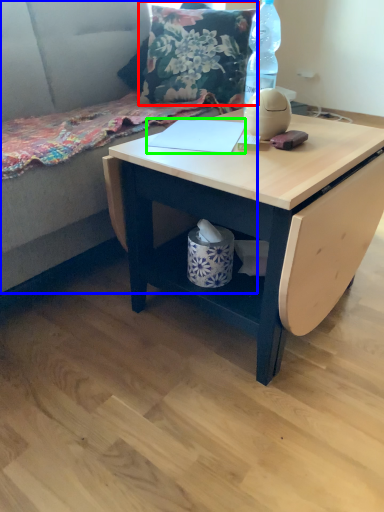
Question: Which object is the farthest from throw pillow (highlighted by a red box)? Choose among these: couch (highlighted by a blue box) or notebook (highlighted by a green box).

Choices:
 (A) couch
 (B) notebook

Answer: (B)